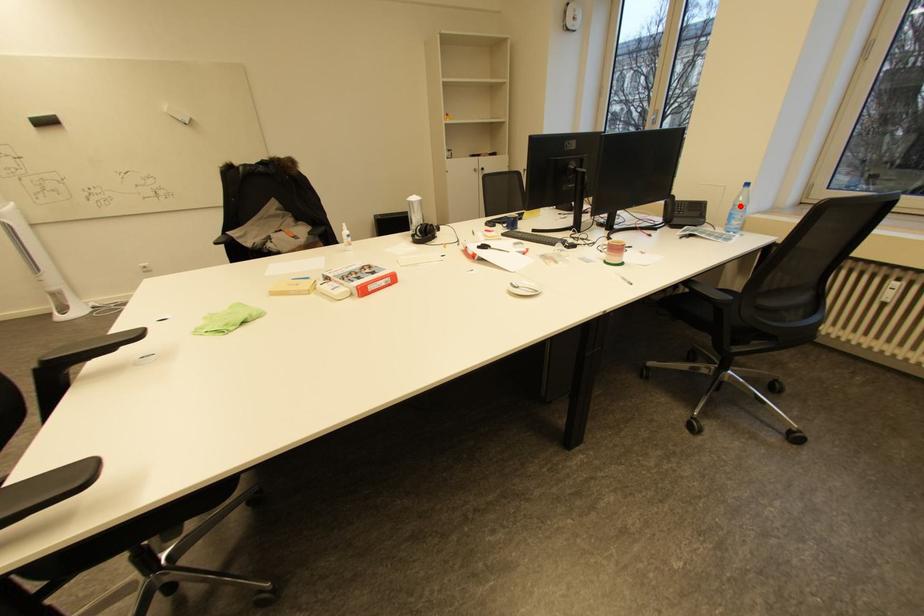
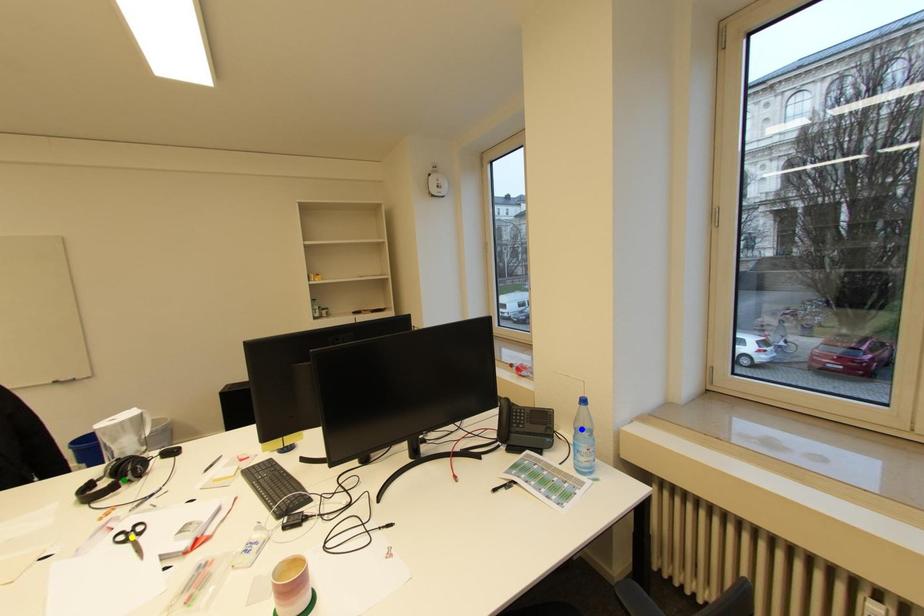
Question: I am providing you with two images of the same scene from different viewpoints. A red point is marked on the first image. You are given multiple points on the second image. Can you choose the point in image 2 that corresponds to the point in image 1?

Choices:
 (A) yellow point
 (B) blue point
 (C) green point

Answer: (B)